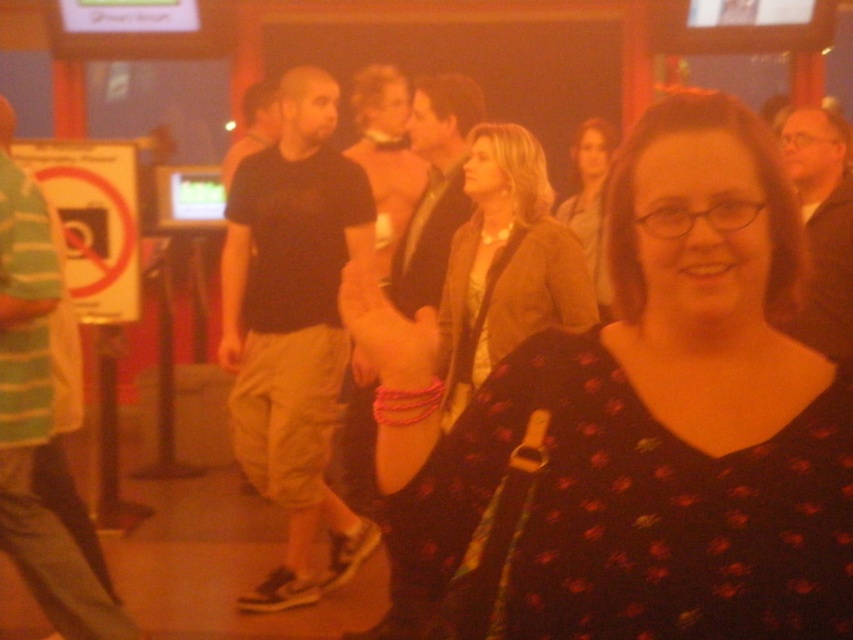
You are standing in the middle of a crowded room and see both the matte brown blazer at center and the dark brown shirt at center. Which one is nearer to you?

The matte brown blazer at center is closer to the viewer than the dark brown shirt at center, so the matte brown blazer at center is nearer to you.